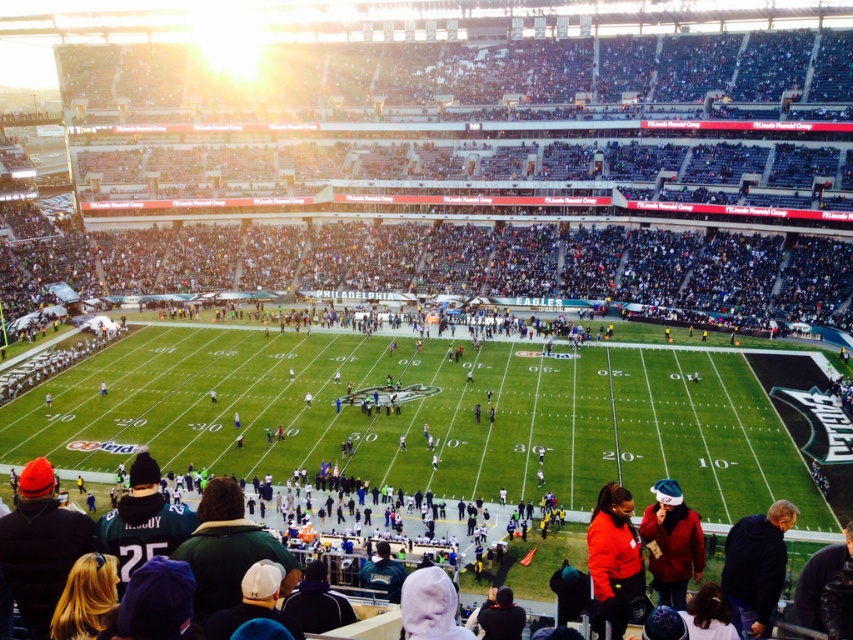
Question: Can you confirm if orange fleece jacket at lower center is thinner than red matte jacket at lower right?

Choices:
 (A) yes
 (B) no

Answer: (A)

Question: Which of the following is the closest to the observer?

Choices:
 (A) (602, 595)
 (B) (666, 536)

Answer: (A)

Question: Which object is closer to the camera taking this photo?

Choices:
 (A) red matte jacket at lower right
 (B) orange fleece jacket at lower center

Answer: (B)

Question: In this image, where is orange fleece jacket at lower center located relative to red matte jacket at lower right?

Choices:
 (A) left
 (B) right

Answer: (A)

Question: Where is orange fleece jacket at lower center located in relation to red matte jacket at lower right in the image?

Choices:
 (A) above
 (B) below

Answer: (A)